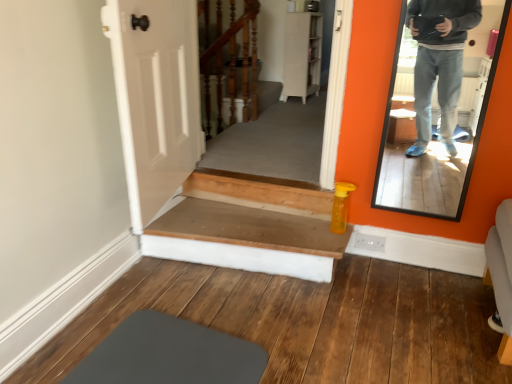
Locate an element on the screen. Image resolution: width=512 pixels, height=384 pixels. unoccupied area in front of wooden stairs at center is located at coordinates point(242,329).